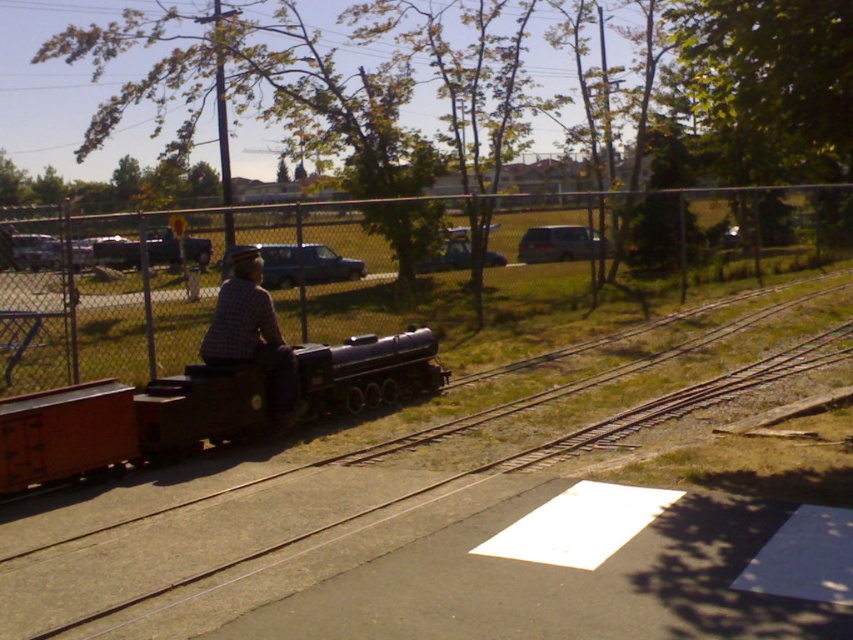
You are a toy engineer designing a new miniature train set. The train needs to fit on the smooth black train track at center without overlapping the matte blue car at center. Based on the scene description, which object is wider and should be considered for spacing?

The smooth black train track at center is wider than the matte blue car at center, so spacing should be adjusted to accommodate the track first.

You are standing at the point where the train tracks curve to the right. Which object from the scene is exactly at the coordinates point (384, 518)?

The smooth black train track at center is located at point (384, 518).